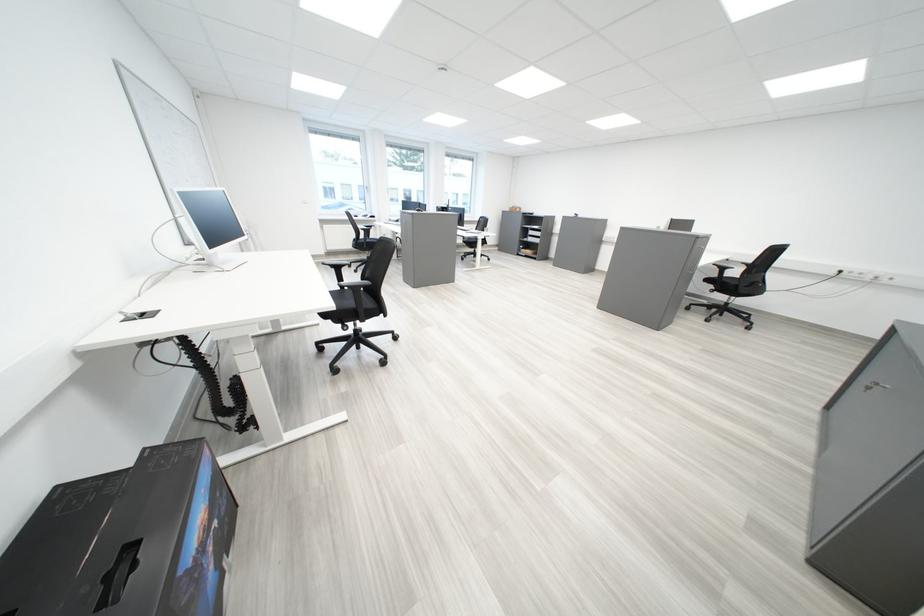
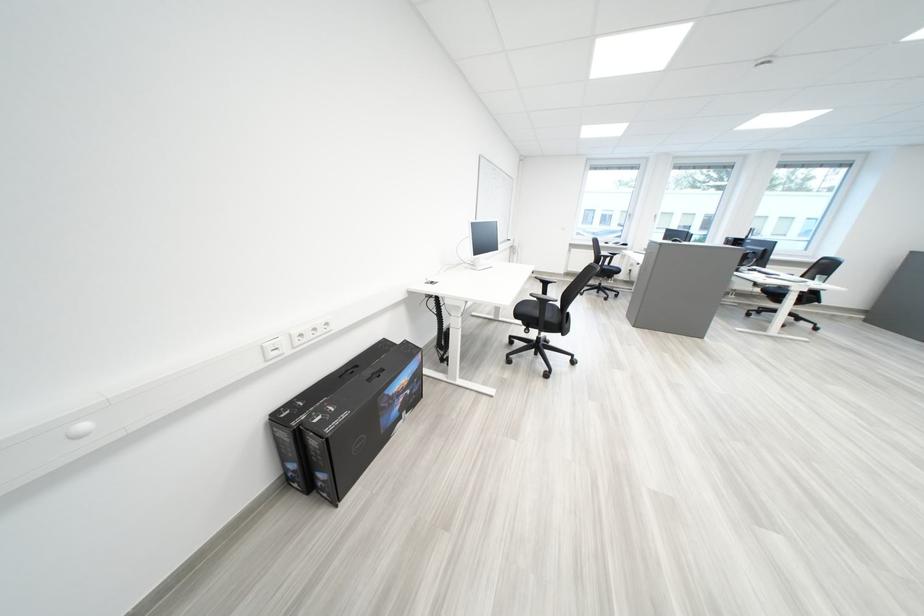
The point at (214, 548) is marked in the first image. Where is the corresponding point in the second image?

(411, 395)